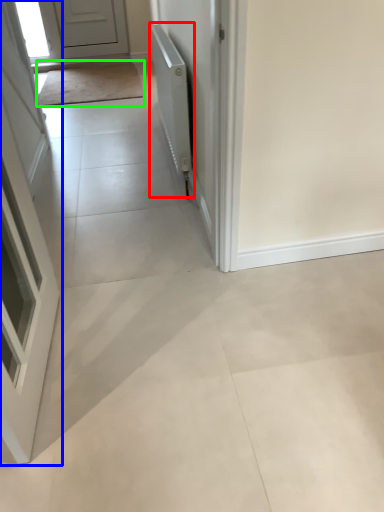
Question: Which object is positioned closest to radiator (highlighted by a red box)? Select from door (highlighted by a blue box) and mat (highlighted by a green box).

Choices:
 (A) door
 (B) mat

Answer: (A)